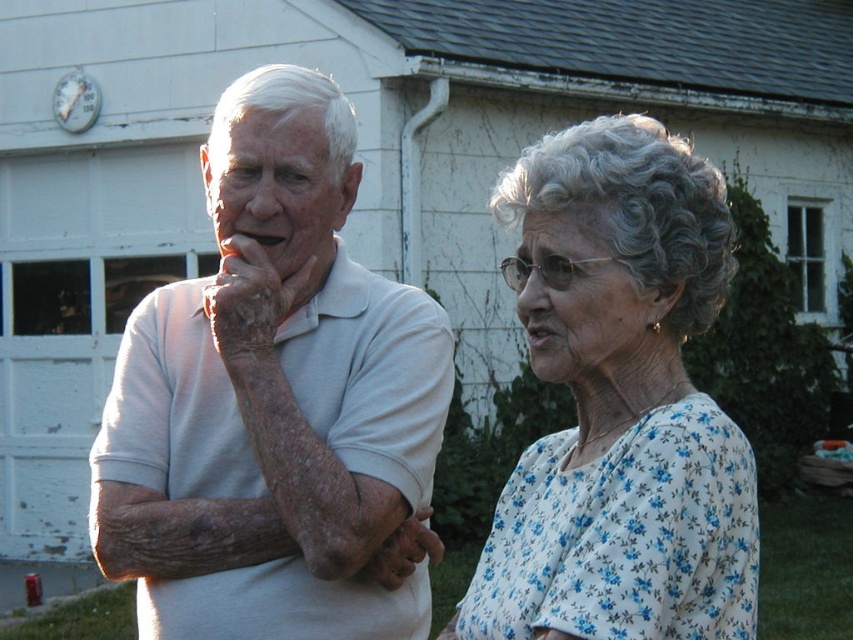
You are standing at the point marked by the coordinates point (287, 440). The two elderly individuals are in front of a white house. How far apart are the two elderly individuals?

The two elderly individuals are 4.31 meters apart.

You are a photographer trying to capture a candid shot of the two people in the scene. You notice the white matte shirt at center and the dry skin at left. Based on their positions, which object is closer to the right edge of the photo?

The white matte shirt at center is positioned on the right side of dry skin at left, so the white matte shirt at center is closer to the right edge of the photo.

You are organizing a photoshoot and need to ensure that the two central outfits are appropriately sized for the models. Given the white matte shirt at center and the white floral blouse at center, which one has a larger width?

The white matte shirt at center has a larger width than the white floral blouse at center.